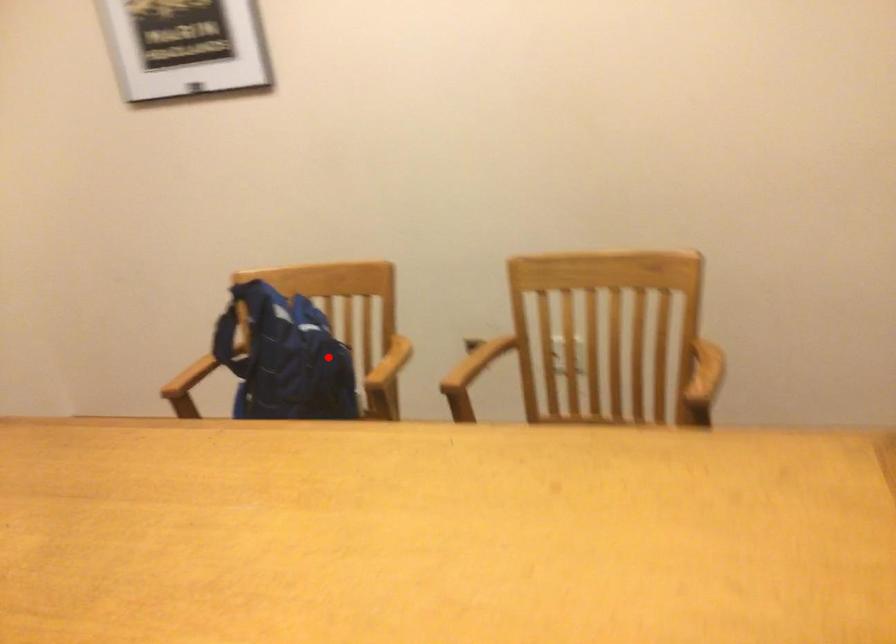
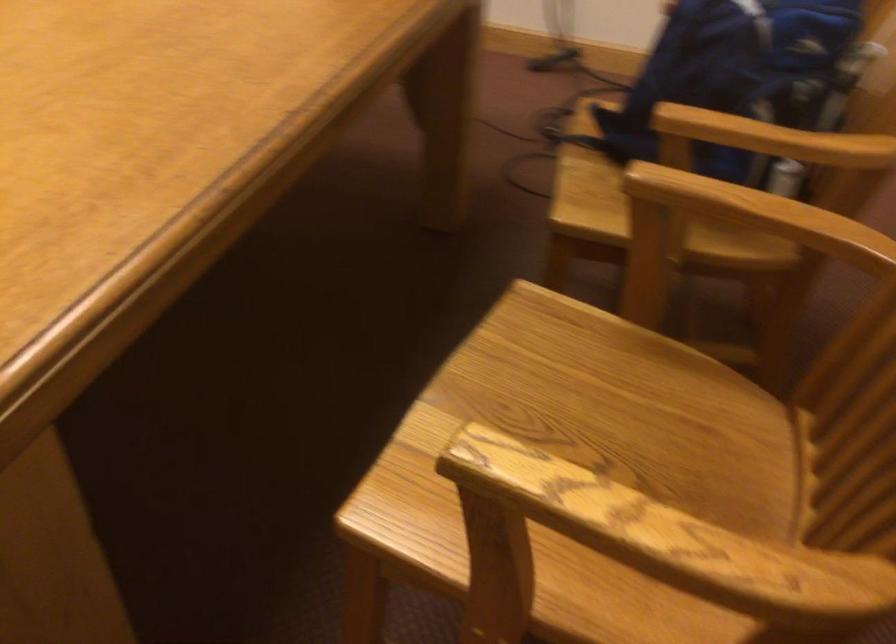
Find the pixel in the second image that matches the highlighted location in the first image.

(736, 73)